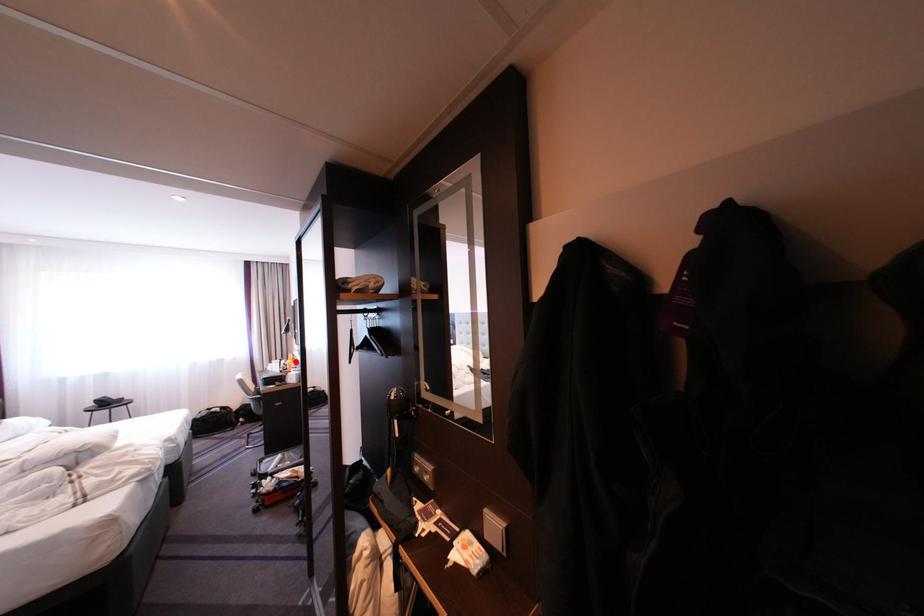
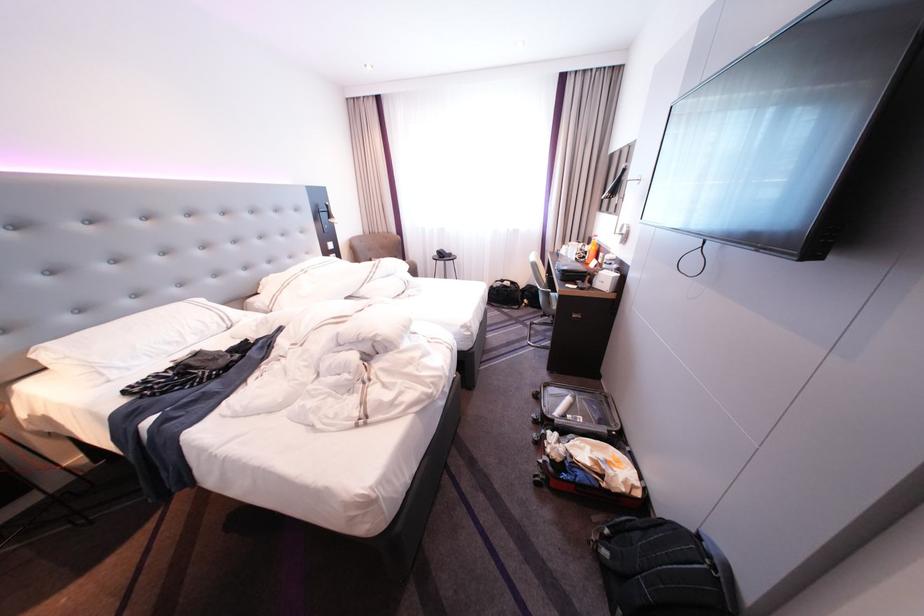
Locate, in the second image, the point that corresponds to the highlighted location in the first image.

(593, 245)